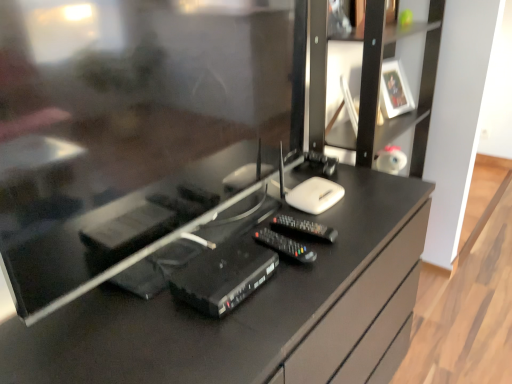
Locate an element on the screen. blank space above black glossy desk at center (from a real-world perspective) is located at coordinates (249, 240).